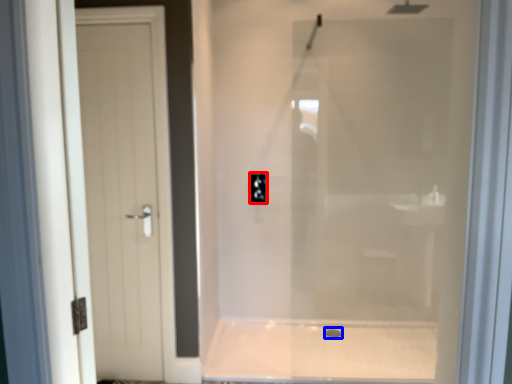
Question: Among these objects, which one is farthest to the camera, electric outlet (highlighted by a red box) or drain (highlighted by a blue box)?

Choices:
 (A) electric outlet
 (B) drain

Answer: (A)